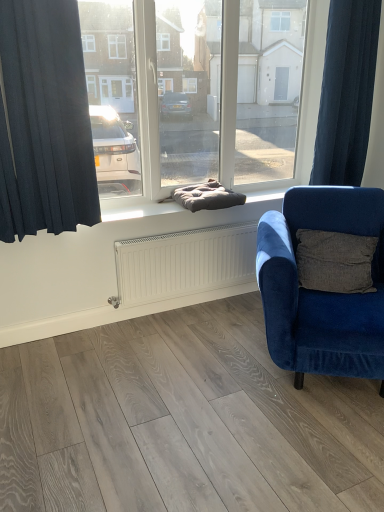
Question: Based on their positions, is dark gray cushion at center located to the left or right of velvet blue armchair at right?

Choices:
 (A) left
 (B) right

Answer: (A)

Question: Is point 112,212 positioned closer to the camera than point 334,218?

Choices:
 (A) farther
 (B) closer

Answer: (A)

Question: Considering the real-world distances, which object is farthest from the dark blue fabric curtain at left, arranged as the 2th curtain when viewed from the back?

Choices:
 (A) dark blue fabric curtain at right, the 1th curtain from the right
 (B) velvet blue armchair at right
 (C) dark gray cushion at center

Answer: (A)

Question: Which object is positioned closest to the dark blue fabric curtain at right, which is the first curtain in back-to-front order?

Choices:
 (A) velvet blue armchair at right
 (B) dark blue fabric curtain at left, marked as the second curtain in a right-to-left arrangement
 (C) dark gray cushion at center

Answer: (C)